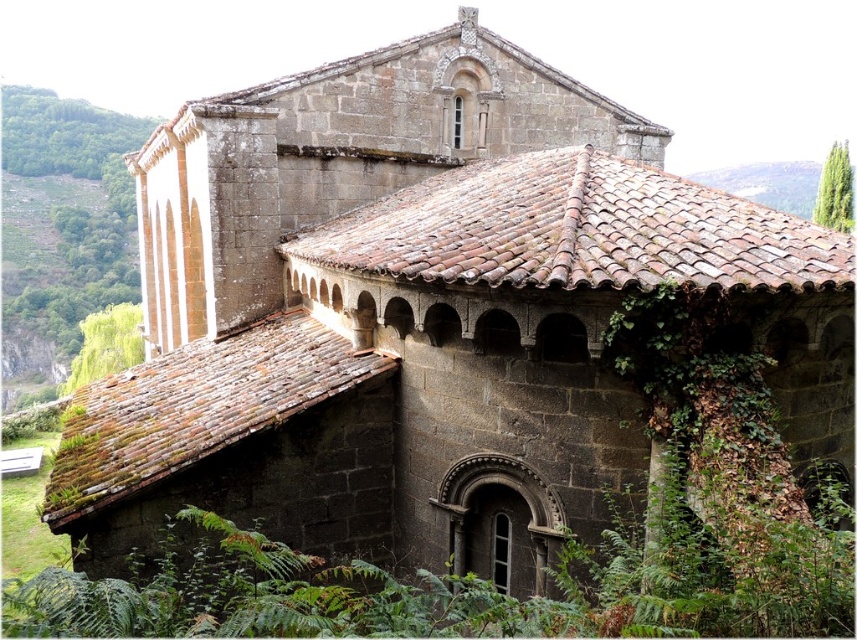
Question: Is green leafy vegetation at upper left above green leafy tree at upper right?

Choices:
 (A) no
 (B) yes

Answer: (B)

Question: Where is green leafy vegetation at upper left located in relation to green leafy tree at upper right in the image?

Choices:
 (A) left
 (B) right

Answer: (A)

Question: Is green leafy vegetation at upper left positioned in front of green leafy tree at upper right?

Choices:
 (A) no
 (B) yes

Answer: (A)

Question: Among these objects, which one is farthest from the camera?

Choices:
 (A) green leafy tree at upper right
 (B) green leafy vegetation at upper left

Answer: (B)